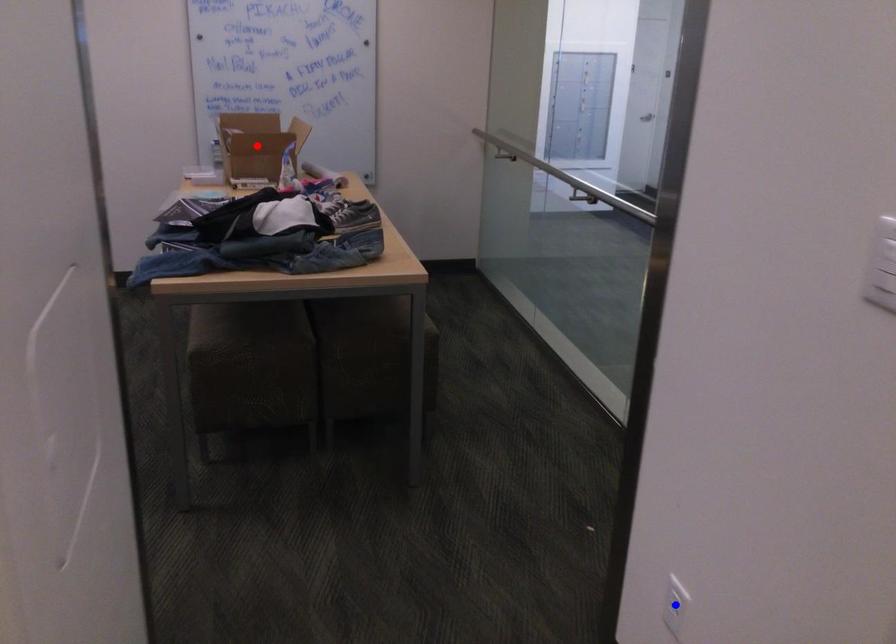
Question: Which of the two points in the image is closer to the camera?

Choices:
 (A) Blue point is closer.
 (B) Red point is closer.

Answer: (A)